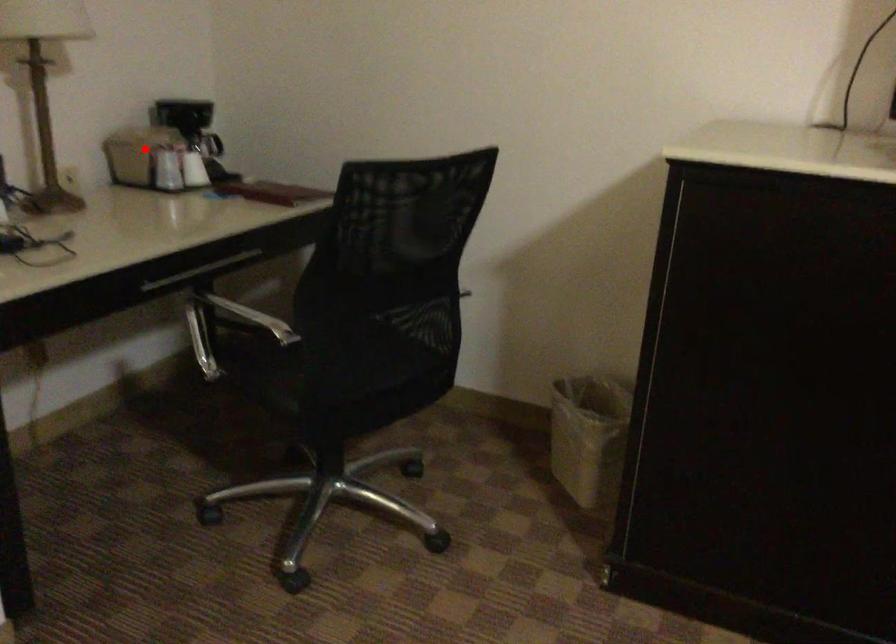
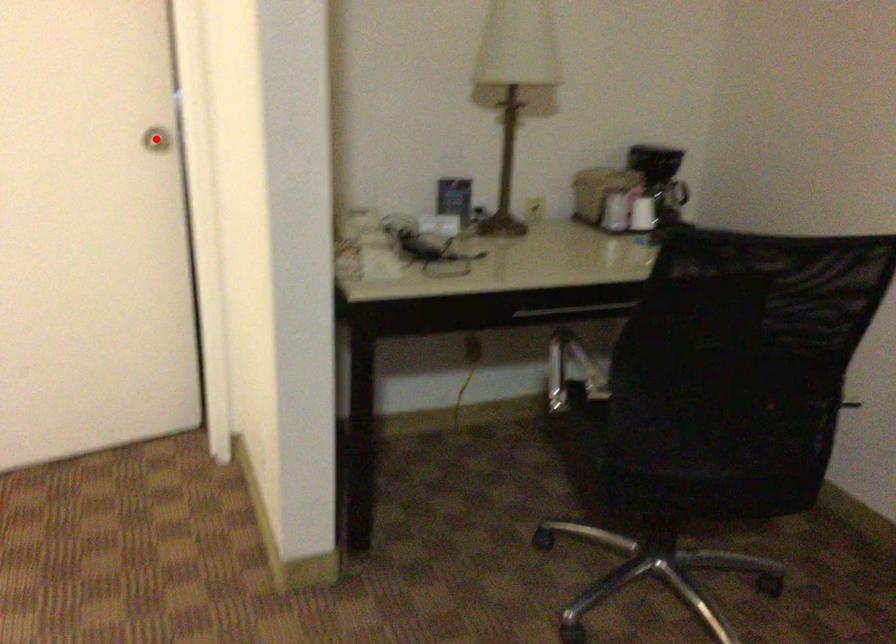
I am providing you with two images of the same scene from different viewpoints. A red point is marked on the first image and another point is marked on the second image. Does the point marked in image1 correspond to the same location as the one in image2?

No